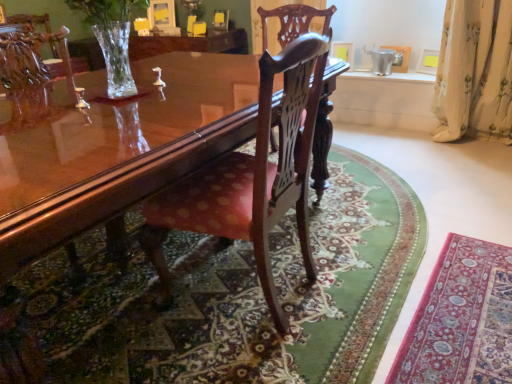
Question: Which direction should I rotate to look at polished wood chair at center, the 2th chair in the front-to-back sequence?

Choices:
 (A) left
 (B) right

Answer: (B)

Question: Does polished wood chair at center, the 2th chair in the front-to-back sequence, have a greater height compared to polished wood chair at center, the 2th chair from the back?

Choices:
 (A) no
 (B) yes

Answer: (A)

Question: Does polished wood chair at center, the 2th chair in the front-to-back sequence, have a larger size compared to polished wood chair at center, the 2th chair from the back?

Choices:
 (A) no
 (B) yes

Answer: (B)

Question: Considering the relative positions of polished wood chair at center, acting as the first chair starting from the back, and polished wood chair at center, the 2th chair from the back, in the image provided, is polished wood chair at center, acting as the first chair starting from the back, to the right of polished wood chair at center, the 2th chair from the back, from the viewer's perspective?

Choices:
 (A) no
 (B) yes

Answer: (B)

Question: Is polished wood chair at center, the 2th chair in the front-to-back sequence, facing towards polished wood chair at center, the 1th chair from the front?

Choices:
 (A) yes
 (B) no

Answer: (A)

Question: From a real-world perspective, does polished wood chair at center, the 2th chair in the front-to-back sequence, stand above polished wood chair at center, the 2th chair from the back?

Choices:
 (A) no
 (B) yes

Answer: (B)

Question: From a real-world perspective, is polished wood chair at center, acting as the first chair starting from the back, beneath polished wood chair at center, the 1th chair from the front?

Choices:
 (A) no
 (B) yes

Answer: (A)

Question: From the image's perspective, is velvet red rug at lower right under white floral fabric curtain at right?

Choices:
 (A) yes
 (B) no

Answer: (A)

Question: Does velvet red rug at lower right have a greater height compared to white floral fabric curtain at right?

Choices:
 (A) yes
 (B) no

Answer: (B)

Question: Is the surface of velvet red rug at lower right in direct contact with white floral fabric curtain at right?

Choices:
 (A) no
 (B) yes

Answer: (A)

Question: From a real-world perspective, is velvet red rug at lower right under white floral fabric curtain at right?

Choices:
 (A) no
 (B) yes

Answer: (B)

Question: Can you confirm if velvet red rug at lower right is positioned to the left of white floral fabric curtain at right?

Choices:
 (A) no
 (B) yes

Answer: (B)

Question: Is velvet red rug at lower right wider than white floral fabric curtain at right?

Choices:
 (A) no
 (B) yes

Answer: (B)

Question: Considering the relative positions of polished wood chair at center, the 1th chair from the front, and glossy wood coffee table at center in the image provided, is polished wood chair at center, the 1th chair from the front, to the right of glossy wood coffee table at center from the viewer's perspective?

Choices:
 (A) yes
 (B) no

Answer: (A)